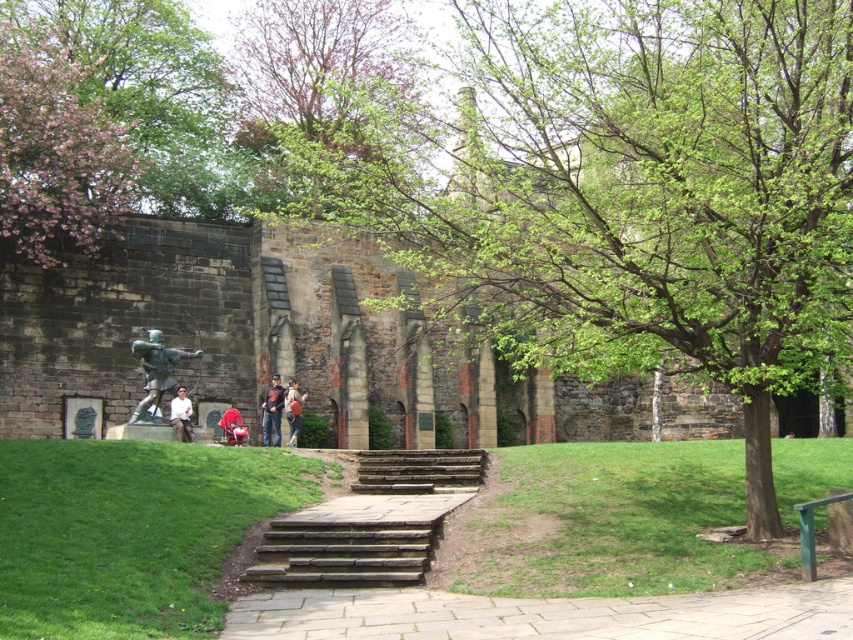
You are a tourist visiting the park and see the bronze statue at center and the denim jacket at center. Which object is located to the left of the other?

The bronze statue at center is positioned on the left side of denim jacket at center.

You are standing at point (544, 614) in the park. What object are you standing on?

You are standing on the paved stone path at center.

You are a tourist visiting the historical site and want to take a photo of the paved stone path at center without the white shirt at lower left appearing in the frame. Which object should you focus on to ensure the other is out of view?

The paved stone path at center is bigger than the white shirt at lower left, so focusing on the paved stone path at center will likely exclude the smaller white shirt at lower left from the frame.